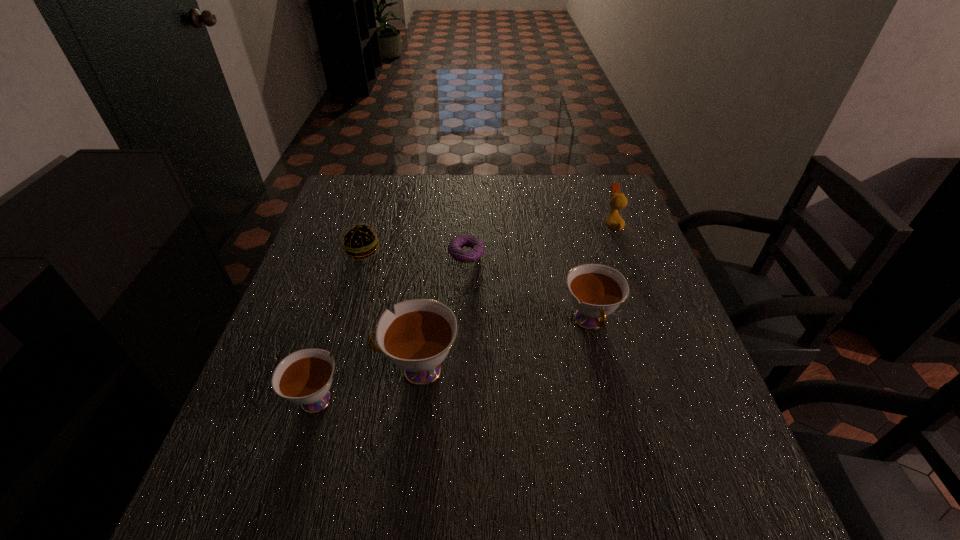
Where is `free location located on the side of the leftmost teacup with the handle`? free location located on the side of the leftmost teacup with the handle is located at coordinates (359, 260).

Identify the location of vacant region located 0.080m on the side of the second teacup from right to left with the handle. [337, 369].

Locate an element on the screen. The height and width of the screenshot is (540, 960). vacant space located on the side of the second teacup from right to left with the handle is located at coordinates (302, 369).

Find the location of `free space located on the side of the second teacup from right to left with the handle`. free space located on the side of the second teacup from right to left with the handle is located at coordinates (342, 369).

Where is `vacant region located 0.240m on the side of the second object from right to left with the handle`? vacant region located 0.240m on the side of the second object from right to left with the handle is located at coordinates (622, 457).

Identify the location of free space located on the right of the patty. (480, 252).

I want to click on vacant space positioned 0.360m on the beak of the rightmost object, so click(479, 225).

This screenshot has height=540, width=960. Find the location of `vacant space located on the beak of the rightmost object`. vacant space located on the beak of the rightmost object is located at coordinates (583, 225).

Where is `vacant space situated 0.210m on the beak of the rightmost object`? vacant space situated 0.210m on the beak of the rightmost object is located at coordinates (531, 225).

In order to click on vacant space located on the right of the doughnut in this screenshot , I will do `click(563, 254)`.